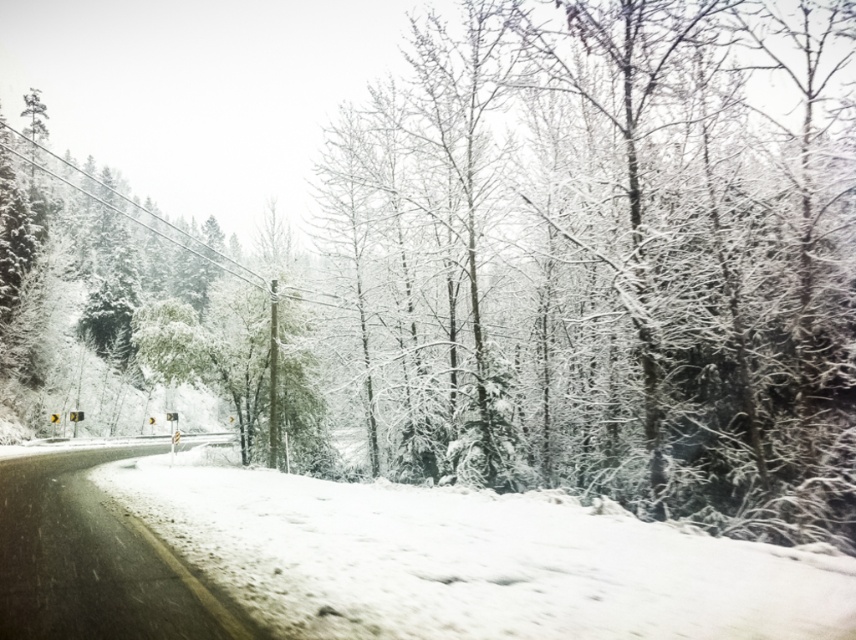
Does white fluffy snow at center have a greater height compared to snowy asphalt road at lower left?

No, white fluffy snow at center is not taller than snowy asphalt road at lower left.

Is white fluffy snow at center positioned in front of snowy asphalt road at lower left?

Yes.

The height and width of the screenshot is (640, 856). I want to click on white fluffy snow at center, so click(x=471, y=561).